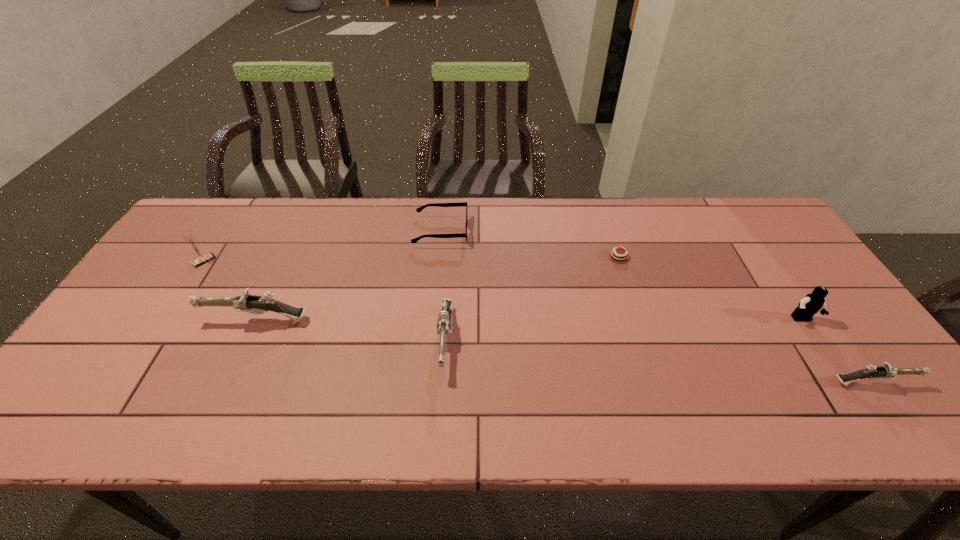
Locate which object is the closest to the third shortest object. Please provide its 2D coordinates. Your answer should be formatted as a tuple, i.e. [(x, y)], where the tuple contains the x and y coordinates of a point satisfying the conditions above.

[(811, 303)]

Identify which object is the sixth closest to the leftmost object. Please provide its 2D coordinates. Your answer should be formatted as a tuple, i.e. [(x, y)], where the tuple contains the x and y coordinates of a point satisfying the conditions above.

[(886, 371)]

I want to click on the second closest gun to the fifth tallest object, so click(x=253, y=304).

I want to click on gun that is the second nearest to the fifth object from left to right, so click(886, 371).

This screenshot has width=960, height=540. In order to click on vacant position in the image that satisfies the following two spatial constraints: 1. on the front-facing side of the Lego; 2. aimed along the barrel of the leftmost gun in this screenshot , I will do `click(803, 321)`.

Where is `vacant area that satisfies the following two spatial constraints: 1. on the front-facing side of the Lego; 2. aimed along the barrel of the leftmost gun`? The image size is (960, 540). vacant area that satisfies the following two spatial constraints: 1. on the front-facing side of the Lego; 2. aimed along the barrel of the leftmost gun is located at coordinates (803, 321).